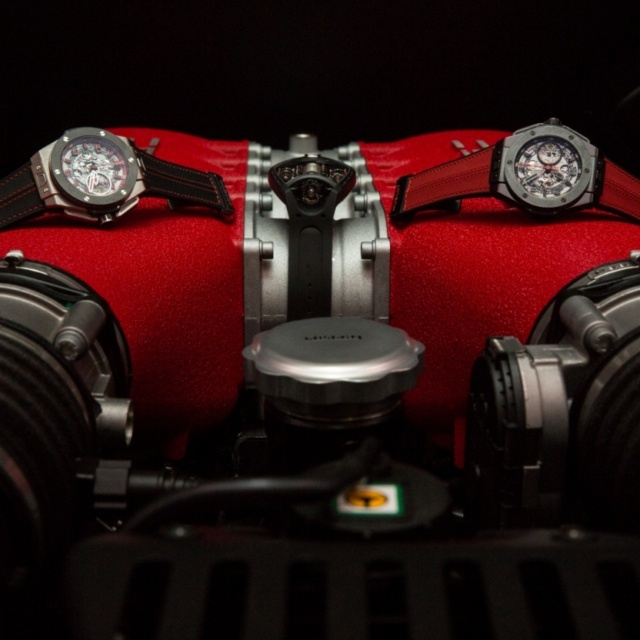
Question: Which point is closer to the camera taking this photo?

Choices:
 (A) (499, 189)
 (B) (83, 147)

Answer: (B)

Question: Which of the following is the farthest from the observer?

Choices:
 (A) (627, 182)
 (B) (544, 152)

Answer: (A)

Question: Can you confirm if leather strap at upper center is bigger than matte black watch at left?

Choices:
 (A) yes
 (B) no

Answer: (A)

Question: Does leather strap at upper center appear under black leather strap at left?

Choices:
 (A) no
 (B) yes

Answer: (A)

Question: Does leather strap at upper center appear under black leather strap at left?

Choices:
 (A) yes
 (B) no

Answer: (B)

Question: Which is farther from the satin silver watch at upper right?

Choices:
 (A) leather strap at upper center
 (B) black leather strap at left
 (C) matte black watch at left

Answer: (C)